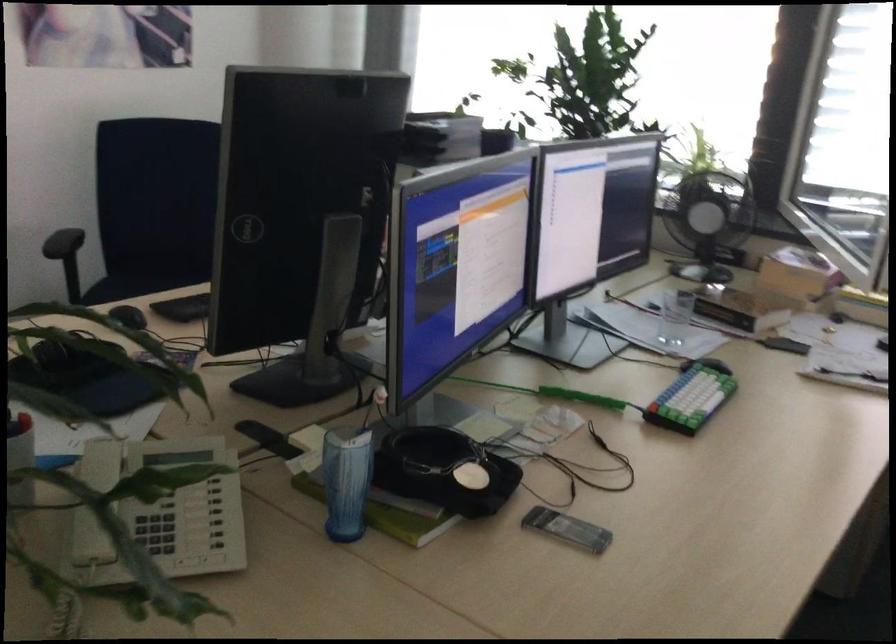
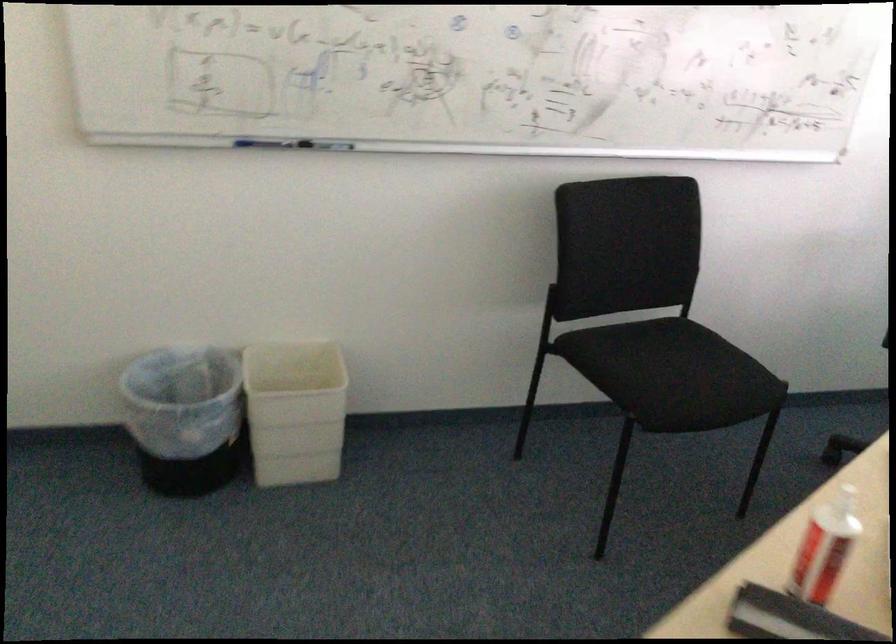
Question: The camera is either moving clockwise (left) or counter-clockwise (right) around the object. The first image is from the beginning of the video and the second image is from the end. Is the camera moving left or right when shooting the video?

Choices:
 (A) Left
 (B) Right

Answer: (B)